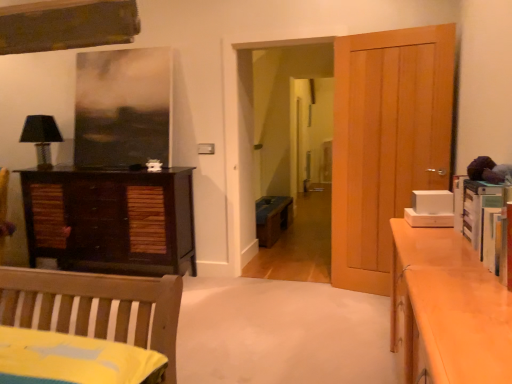
Question: Based on their sizes in the image, would you say dark wood cabinet at left is bigger or smaller than black fabric lampshade at left?

Choices:
 (A) big
 (B) small

Answer: (A)

Question: In the image, is dark wood cabinet at left positioned in front of or behind black fabric lampshade at left?

Choices:
 (A) behind
 (B) front

Answer: (B)

Question: Which object is the closest to the wooden bench at center?

Choices:
 (A) light brown wooden door at right
 (B) black fabric lampshade at left
 (C) dark wood cabinet at left

Answer: (C)

Question: Estimate the real-world distances between objects in this image. Which object is closer to the dark wood cabinet at left?

Choices:
 (A) light brown wooden door at right
 (B) wooden bench at center
 (C) black fabric lampshade at left

Answer: (C)